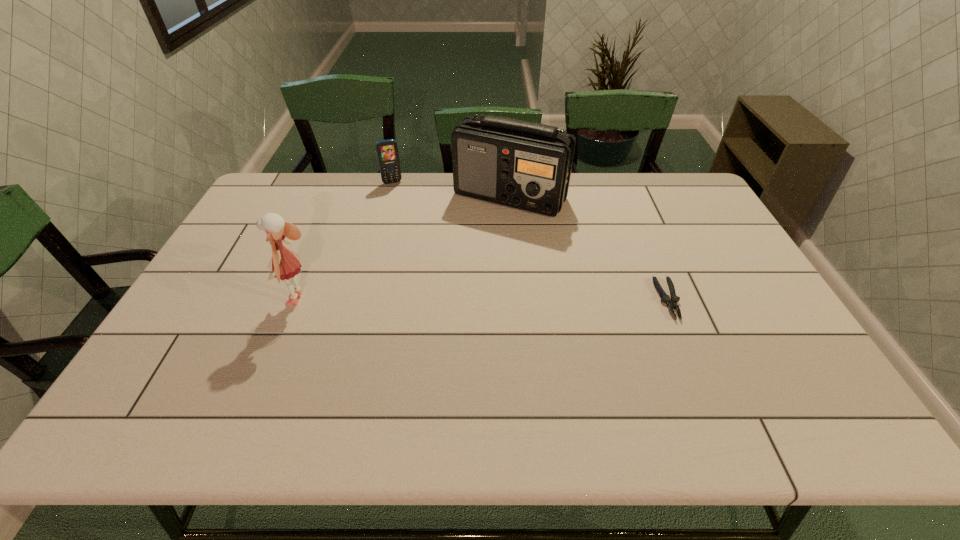
Find the location of a particular element. vacant space on the desktop that is between the leftmost object and the rightmost object and is positioned on the screen of the third object from right to left is located at coordinates (436, 300).

Locate an element on the screen. The width and height of the screenshot is (960, 540). free space on the desktop that is between the leftmost object and the shortest object and is positioned on the front panel of the radio receiver is located at coordinates (539, 300).